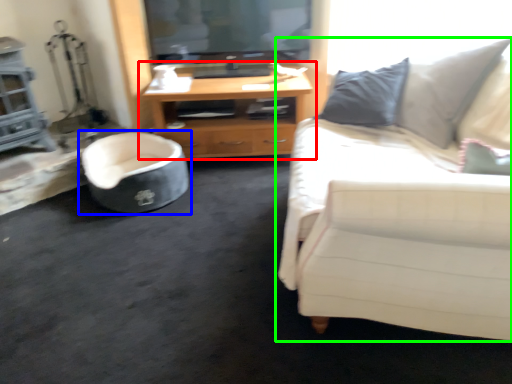
Question: Which object is the farthest from cabinetry (highlighted by a red box)? Choose among these: chair (highlighted by a blue box) or studio couch (highlighted by a green box).

Choices:
 (A) chair
 (B) studio couch

Answer: (B)